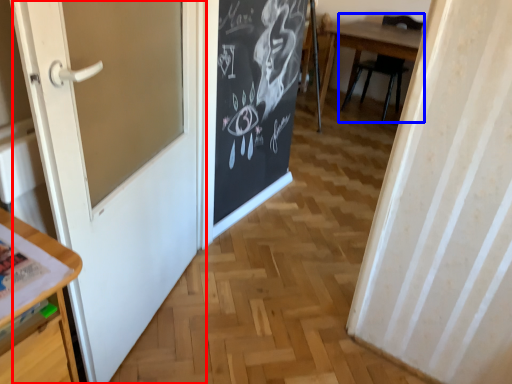
Question: Which of the following is the closest to the observer, door (highlighted by a red box) or chair (highlighted by a blue box)?

Choices:
 (A) door
 (B) chair

Answer: (A)